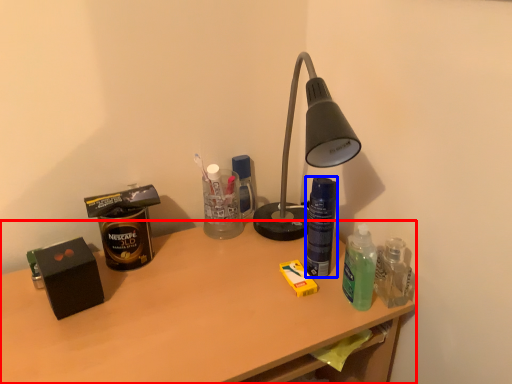
Question: Among these objects, which one is farthest to the camera, desk (highlighted by a red box) or bottle (highlighted by a blue box)?

Choices:
 (A) desk
 (B) bottle

Answer: (B)